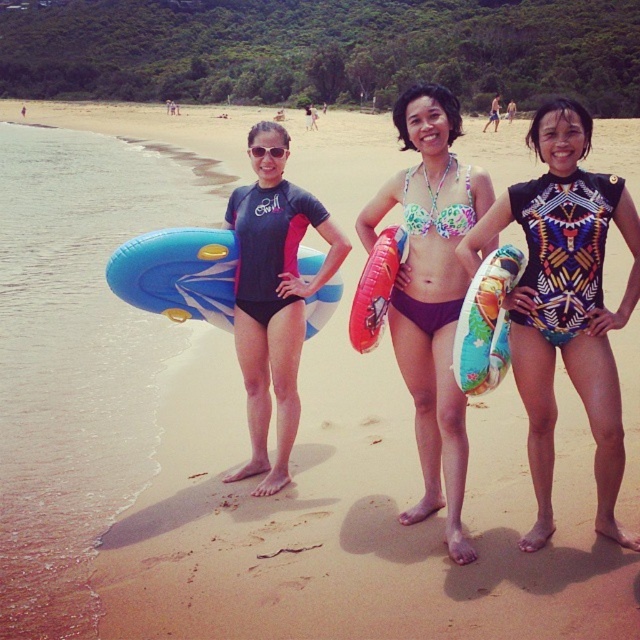
Question: Observing the image, what is the correct spatial positioning of matte black wetsuit at center in reference to red inflatable ring at center?

Choices:
 (A) right
 (B) left

Answer: (B)

Question: Which of the following is the farthest from the observer?

Choices:
 (A) floral bikini at center
 (B) blue inflatable ring at center
 (C) multicolored inflatable ring at center
 (D) matte black wetsuit at center

Answer: (B)

Question: Estimate the real-world distances between objects in this image. Which object is closer to the red inflatable ring at center?

Choices:
 (A) blue inflatable ring at center
 (B) multicolored inflatable ring at center
 (C) matte black wetsuit at center

Answer: (B)

Question: Does floral bikini at center have a greater width compared to matte black wetsuit at center?

Choices:
 (A) no
 (B) yes

Answer: (A)

Question: Considering the real-world distances, which object is closest to the blue inflatable ring at center?

Choices:
 (A) blue rubber ring at center
 (B) red inflatable ring at center

Answer: (B)

Question: Is printed fabric swimsuit at center to the left of matte black wetsuit at center from the viewer's perspective?

Choices:
 (A) yes
 (B) no

Answer: (B)